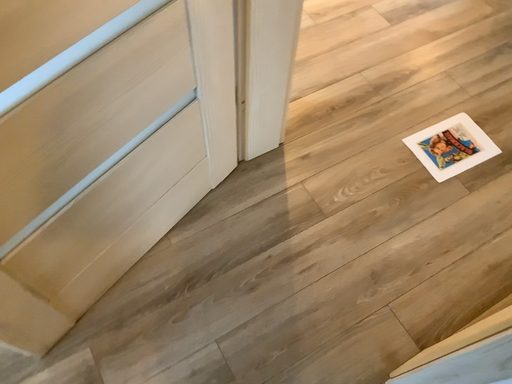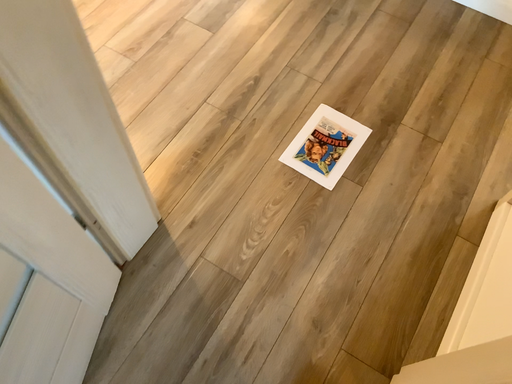
Question: Which way did the camera rotate in the video?

Choices:
 (A) rotated left
 (B) rotated right

Answer: (B)